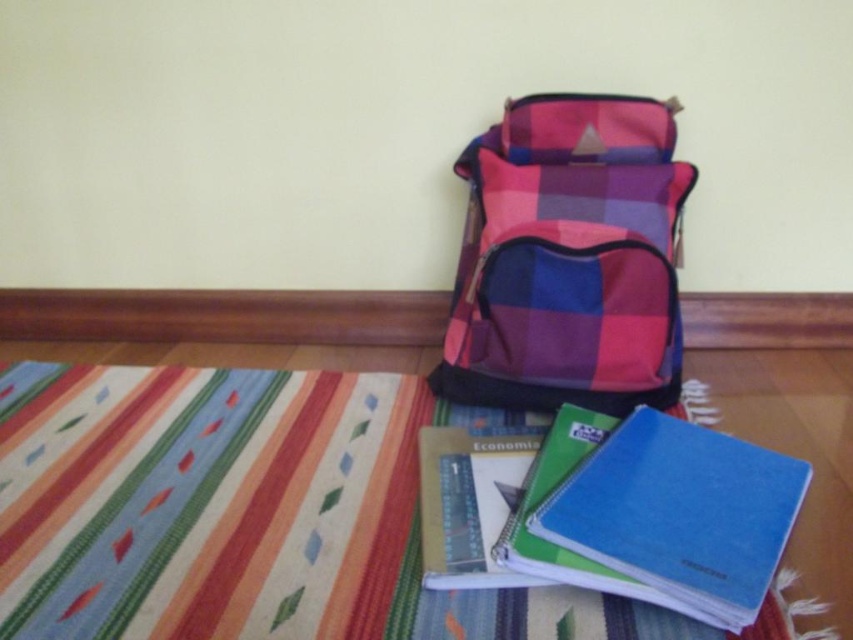
Which is more to the left, striped fabric mat at lower center or blue matte notebook at lower right?

Positioned to the left is striped fabric mat at lower center.

Which of these two, striped fabric mat at lower center or blue matte notebook at lower right, stands shorter?

Standing shorter between the two is blue matte notebook at lower right.

In order to click on striped fabric mat at lower center in this screenshot , I will do `click(204, 500)`.

Who is lower down, striped fabric mat at lower center or plaid fabric backpack at center?

Positioned lower is striped fabric mat at lower center.

Where is `striped fabric mat at lower center`? This screenshot has width=853, height=640. striped fabric mat at lower center is located at coordinates (204, 500).

Image resolution: width=853 pixels, height=640 pixels. What are the coordinates of `striped fabric mat at lower center` in the screenshot? It's located at (204, 500).

Does point (451, 342) lie in front of point (695, 452)?

That is False.

Locate an element on the screen. plaid fabric backpack at center is located at coordinates (569, 259).